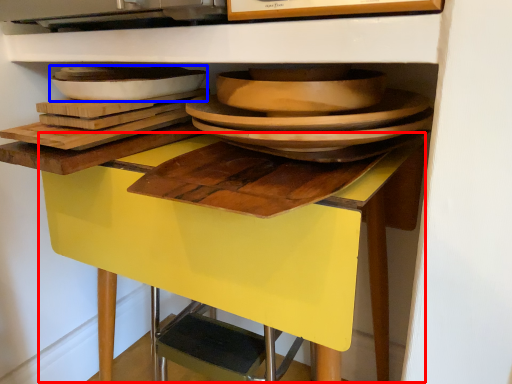
Question: Which point is further to the camera, table (highlighted by a red box) or platter (highlighted by a blue box)?

Choices:
 (A) table
 (B) platter

Answer: (B)